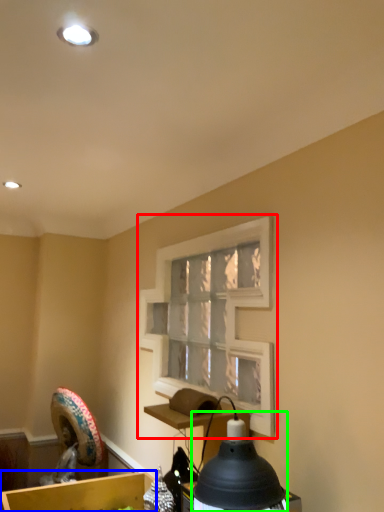
Question: Considering the real-world distances, which object is farthest from window frame (highlighted by a red box)? cardboard box (highlighted by a blue box) or lamp (highlighted by a green box)?

Choices:
 (A) cardboard box
 (B) lamp

Answer: (A)